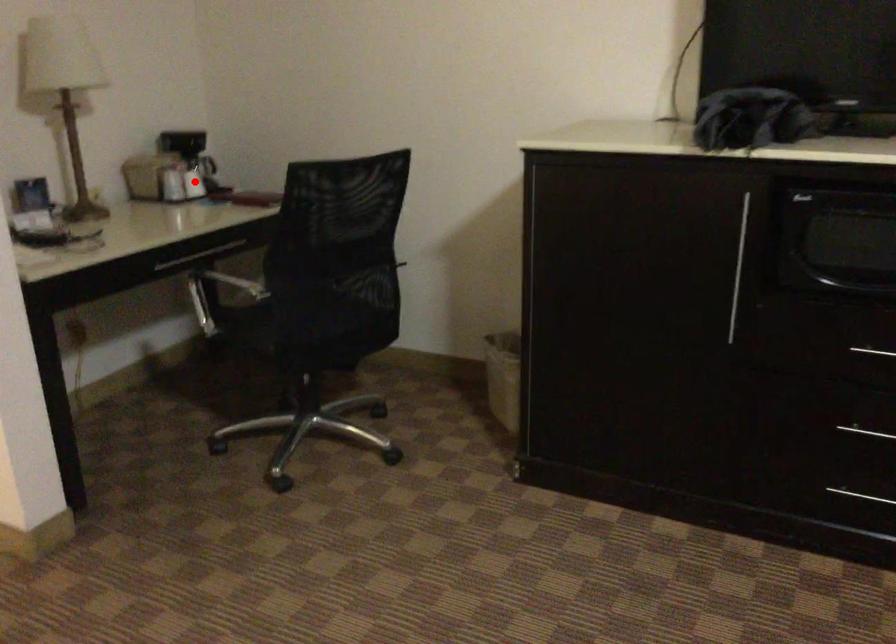
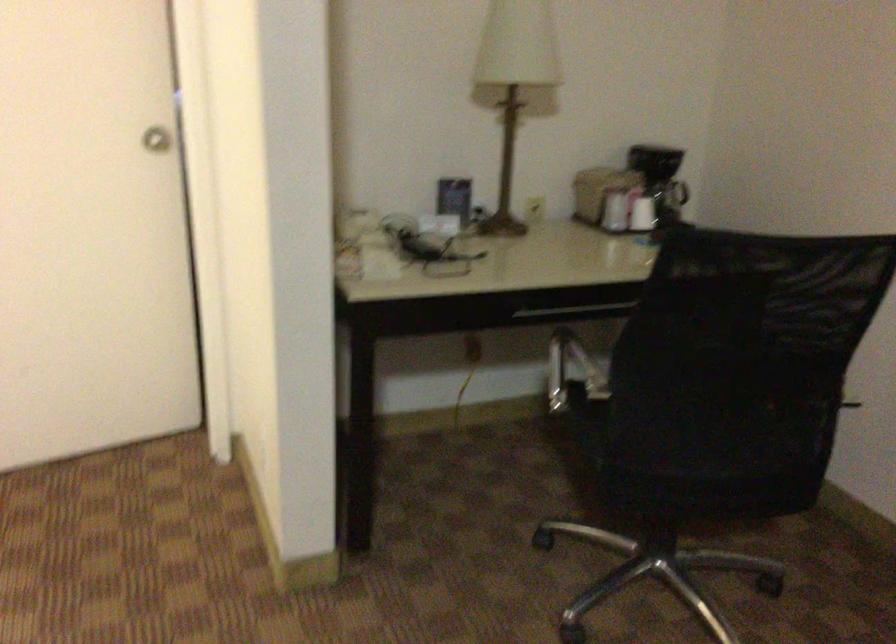
Where in the second image is the point corresponding to the highlighted location from the first image?

(642, 214)